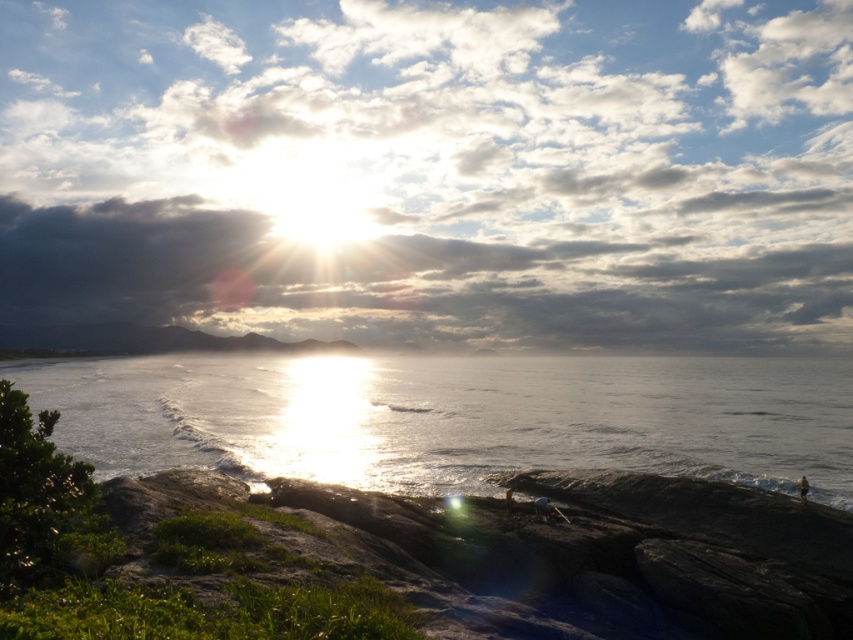
Question: Is cloudy sky at upper center thinner than glistening silver water at center?

Choices:
 (A) no
 (B) yes

Answer: (A)

Question: Is cloudy sky at upper center closer to camera compared to glistening silver water at center?

Choices:
 (A) yes
 (B) no

Answer: (B)

Question: Which point appears closest to the camera in this image?

Choices:
 (A) (622, 173)
 (B) (257, 401)

Answer: (B)

Question: Which point is farther to the camera?

Choices:
 (A) glistening silver water at center
 (B) cloudy sky at upper center

Answer: (B)

Question: Which point appears farthest from the camera in this image?

Choices:
 (A) (303, 221)
 (B) (194, 429)

Answer: (A)

Question: Is cloudy sky at upper center to the left of glistening silver water at center from the viewer's perspective?

Choices:
 (A) yes
 (B) no

Answer: (A)